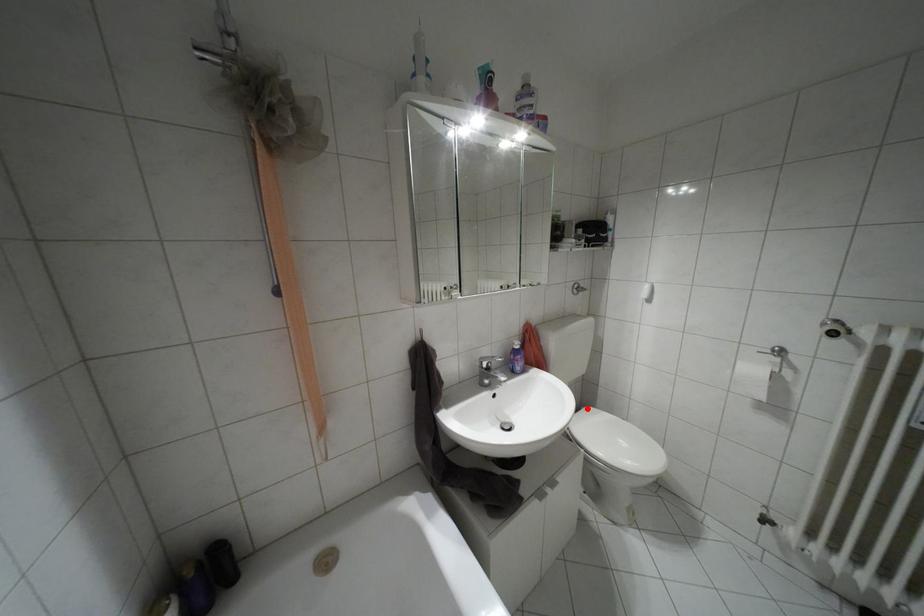
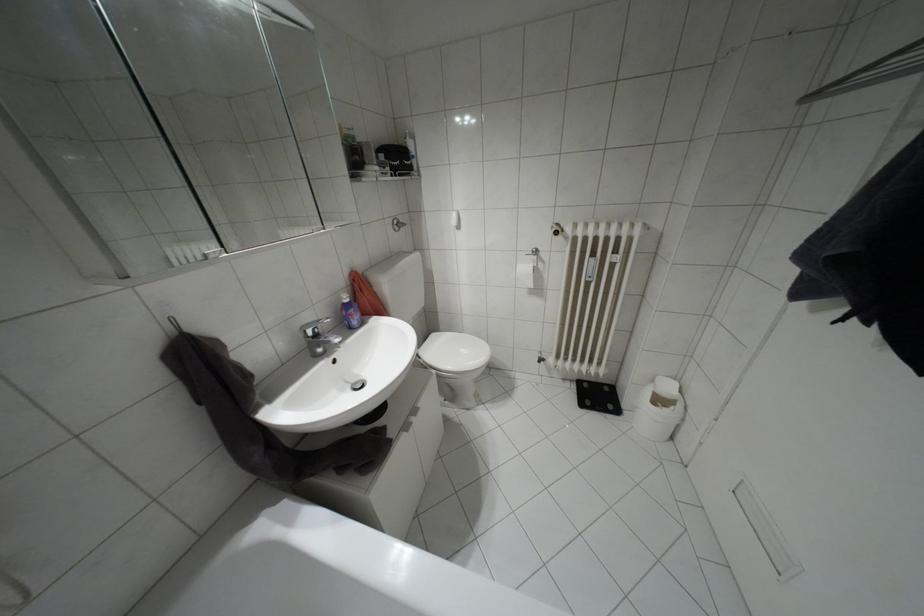
Question: I am providing you with two images of the same scene from different viewpoints. In image1, a red point is highlighted. Considering the same 3D point in image2, which of the following is correct?

Choices:
 (A) It is closer
 (B) It is farther

Answer: (A)